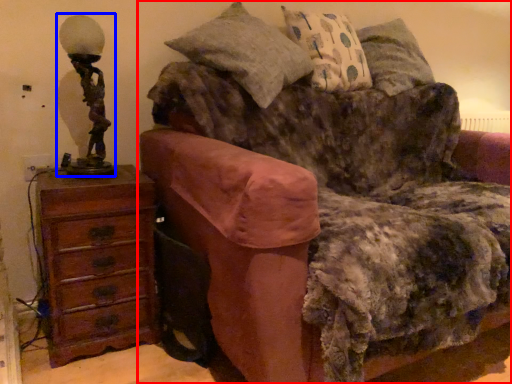
Question: Among these objects, which one is nearest to the camera, studio couch (highlighted by a red box) or table lamp (highlighted by a blue box)?

Choices:
 (A) studio couch
 (B) table lamp

Answer: (A)